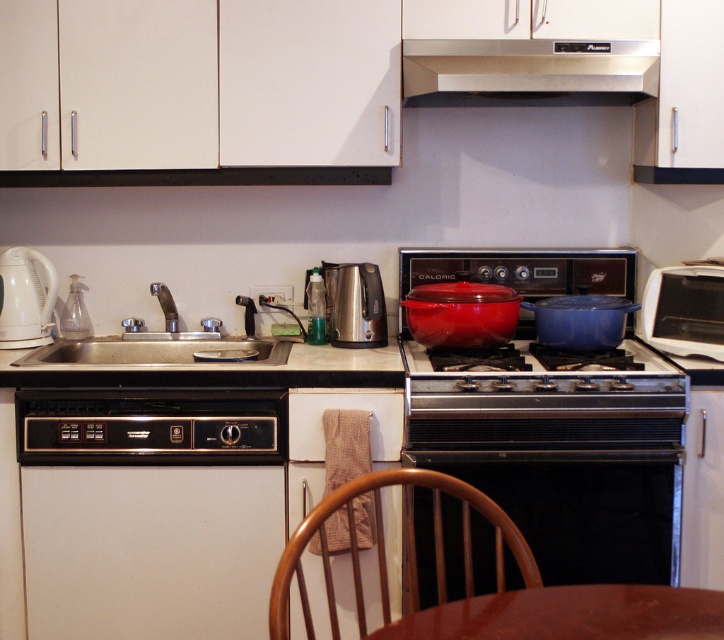
You are a kitchen designer planning to install a new appliance that requires a minimum width of 60 cm. You have two spaces available in the kitchen scene described. Which object, the stainless steel exhaust hood at upper center or the beige laminate countertop at lower left, would you choose to place the appliance?

The beige laminate countertop at lower left has a greater width than the stainless steel exhaust hood at upper center, so the beige laminate countertop at lower left would be the better choice for placing the appliance requiring a minimum width of 60 cm.

You are designing a kitchen layout and need to place a new appliance that requires 1.2 meters of space. You have the black matte oven at center and the beige laminate countertop at lower left available. Which one can accommodate the appliance based on their widths?

The beige laminate countertop at lower left has a greater width than the black matte oven at center. Since the appliance requires 1.2 meters of space, the beige laminate countertop at lower left is more likely to accommodate it due to its larger width.